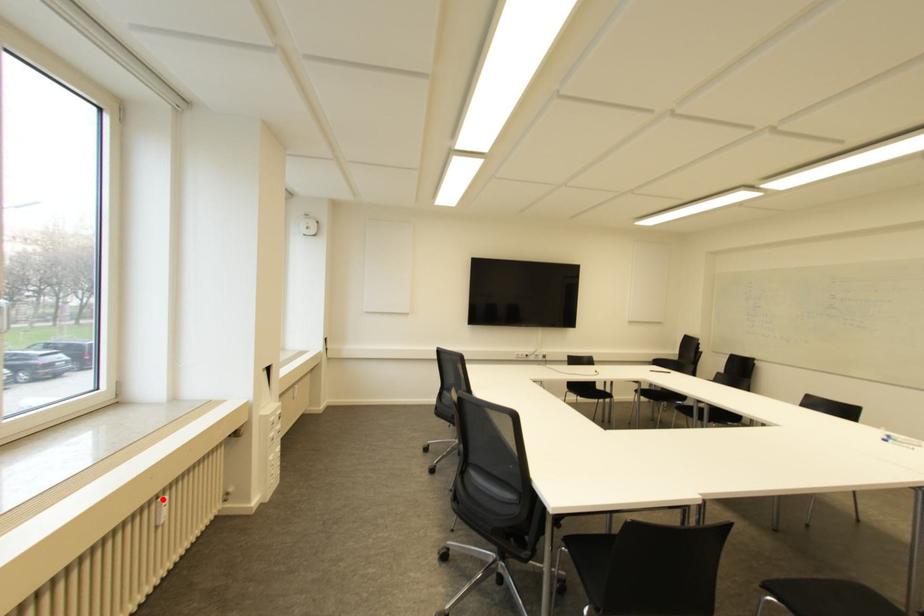
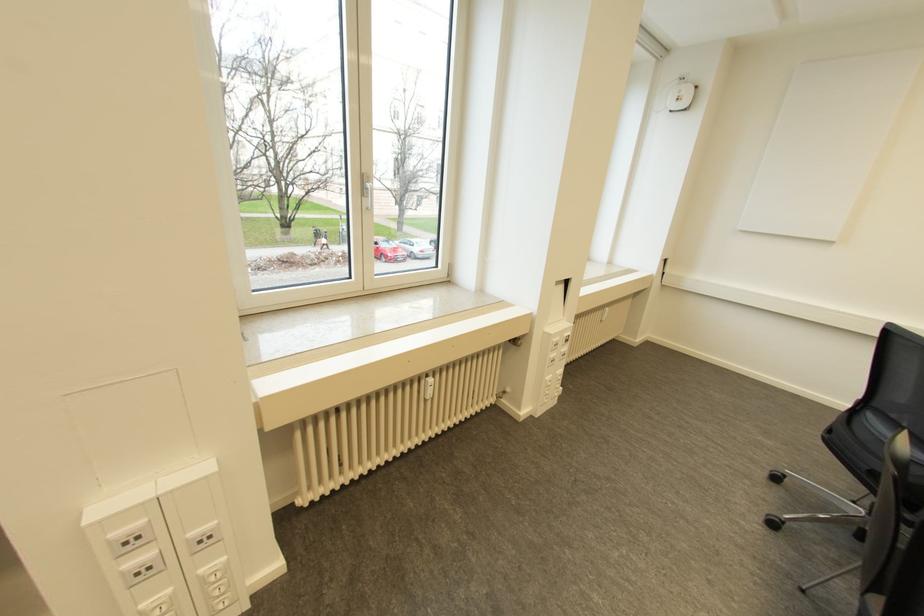
The point at the highlighted location is marked in the first image. Where is the corresponding point in the second image?

(430, 379)